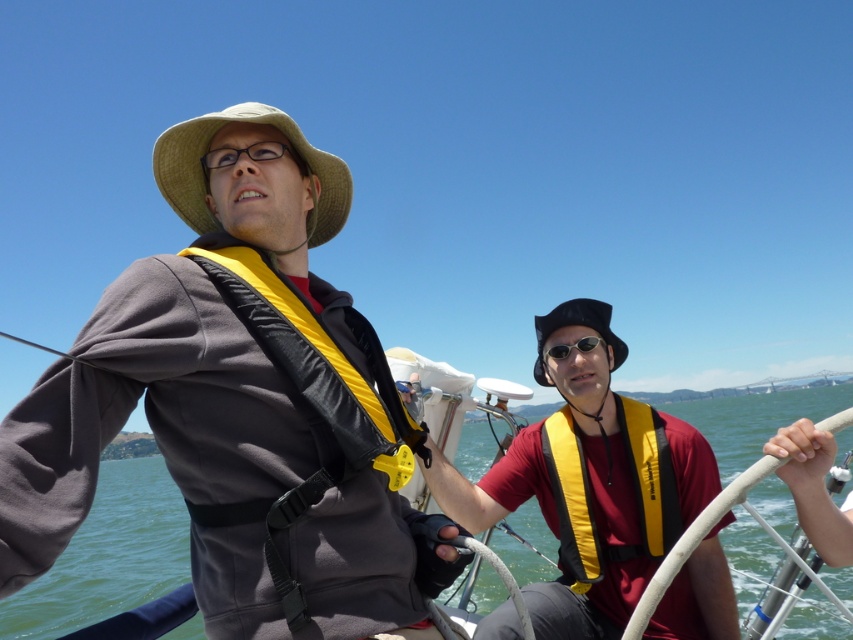
Describe the element at coordinates (589, 481) in the screenshot. The height and width of the screenshot is (640, 853). I see `matte yellow life vest at right` at that location.

Between matte yellow life vest at right and clear blue water at center, which one is positioned lower?

clear blue water at center

Is point (722, 563) farther from viewer compared to point (128, 600)?

No, it is not.

I want to click on matte yellow life vest at right, so click(589, 481).

Which is below, clear blue water at center or matte black goggles at upper center?

clear blue water at center is lower down.

Is clear blue water at center bigger than matte black goggles at upper center?

Yes.

The width and height of the screenshot is (853, 640). Describe the element at coordinates (108, 554) in the screenshot. I see `clear blue water at center` at that location.

The height and width of the screenshot is (640, 853). In order to click on clear blue water at center in this screenshot , I will do `click(108, 554)`.

Who is more forward, [183,168] or [219,157]?

Point [219,157] is more forward.

Does point (169, 184) come closer to viewer compared to point (271, 150)?

No, it is behind (271, 150).

Find the location of a particular element. The height and width of the screenshot is (640, 853). straw hat at upper left is located at coordinates (207, 148).